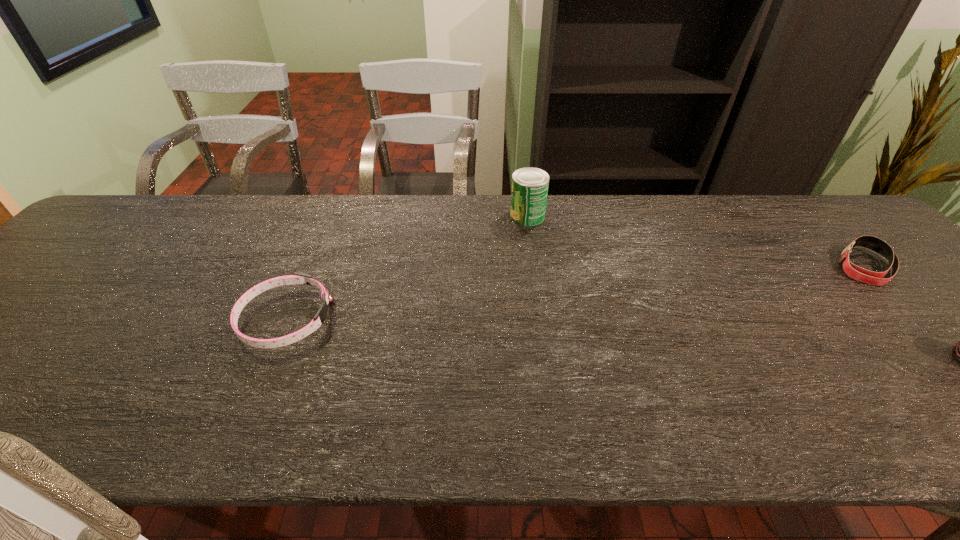
At what (x,y) coordinates should I click in order to perform the action: click on object present at the right edge. Please return your answer as a coordinate pair (x, y). The width and height of the screenshot is (960, 540). Looking at the image, I should click on (857, 273).

The width and height of the screenshot is (960, 540). I want to click on free spot at the far edge of the desktop, so click(501, 201).

The width and height of the screenshot is (960, 540). In order to click on vacant space at the near edge in this screenshot , I will do `click(638, 418)`.

I want to click on vacant space at the left edge, so click(89, 255).

In the image, there is a desktop. Where is `vacant region at the far left corner`? vacant region at the far left corner is located at coordinates (108, 235).

The width and height of the screenshot is (960, 540). Find the location of `free space that is in between the leftmost object and the can`. free space that is in between the leftmost object and the can is located at coordinates (407, 267).

Find the location of a particular element. Image resolution: width=960 pixels, height=540 pixels. free spot between the leftmost object and the second object from left to right is located at coordinates (407, 267).

Identify the location of empty space that is in between the farthest object and the nearest object. (407, 267).

Image resolution: width=960 pixels, height=540 pixels. In order to click on object that is the closest to the nearer dog collar in this screenshot , I will do `click(530, 185)`.

In order to click on object that is the second closest one to the farthest object in this screenshot , I will do `click(857, 273)`.